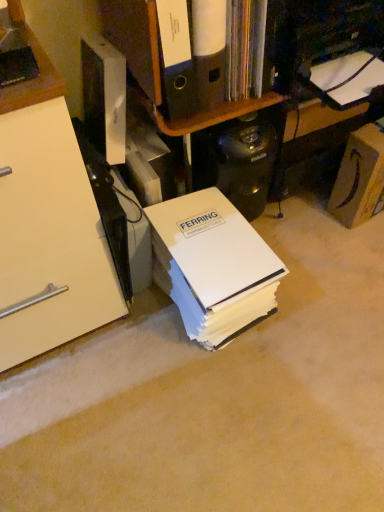
Question: Is white cardboard shelf at upper center shorter than white paper at center?

Choices:
 (A) no
 (B) yes

Answer: (B)

Question: Considering the relative positions of white cardboard shelf at upper center and white paper at center in the image provided, is white cardboard shelf at upper center to the left of white paper at center from the viewer's perspective?

Choices:
 (A) yes
 (B) no

Answer: (A)

Question: Does white cardboard shelf at upper center have a greater width compared to white paper at center?

Choices:
 (A) yes
 (B) no

Answer: (B)

Question: From the image's perspective, is white cardboard shelf at upper center over white paper at center?

Choices:
 (A) yes
 (B) no

Answer: (A)

Question: Is white cardboard shelf at upper center placed right next to white paper at center?

Choices:
 (A) yes
 (B) no

Answer: (B)

Question: Based on their positions, is matte black coffee maker at upper right located to the left or right of matte brown cardboard box at right?

Choices:
 (A) right
 (B) left

Answer: (B)

Question: From a real-world perspective, relative to matte brown cardboard box at right, is matte black coffee maker at upper right vertically above or below?

Choices:
 (A) above
 (B) below

Answer: (B)

Question: In the image, is matte black coffee maker at upper right positioned in front of or behind matte brown cardboard box at right?

Choices:
 (A) behind
 (B) front

Answer: (A)

Question: From the image's perspective, is matte black coffee maker at upper right positioned above or below matte brown cardboard box at right?

Choices:
 (A) below
 (B) above

Answer: (B)

Question: Would you say black plastic computer tower at center is inside or outside matte brown cardboard box at right?

Choices:
 (A) outside
 (B) inside

Answer: (A)

Question: From the image's perspective, is black plastic computer tower at center located above or below matte brown cardboard box at right?

Choices:
 (A) below
 (B) above

Answer: (A)

Question: Considering their positions, is black plastic computer tower at center located in front of or behind matte brown cardboard box at right?

Choices:
 (A) front
 (B) behind

Answer: (A)

Question: Is black plastic computer tower at center to the left or to the right of matte brown cardboard box at right in the image?

Choices:
 (A) right
 (B) left

Answer: (B)

Question: From the image's perspective, is white paper at center above or below matte brown cardboard box at right?

Choices:
 (A) above
 (B) below

Answer: (B)

Question: Relative to matte brown cardboard box at right, is white paper at center in front or behind?

Choices:
 (A) front
 (B) behind

Answer: (A)